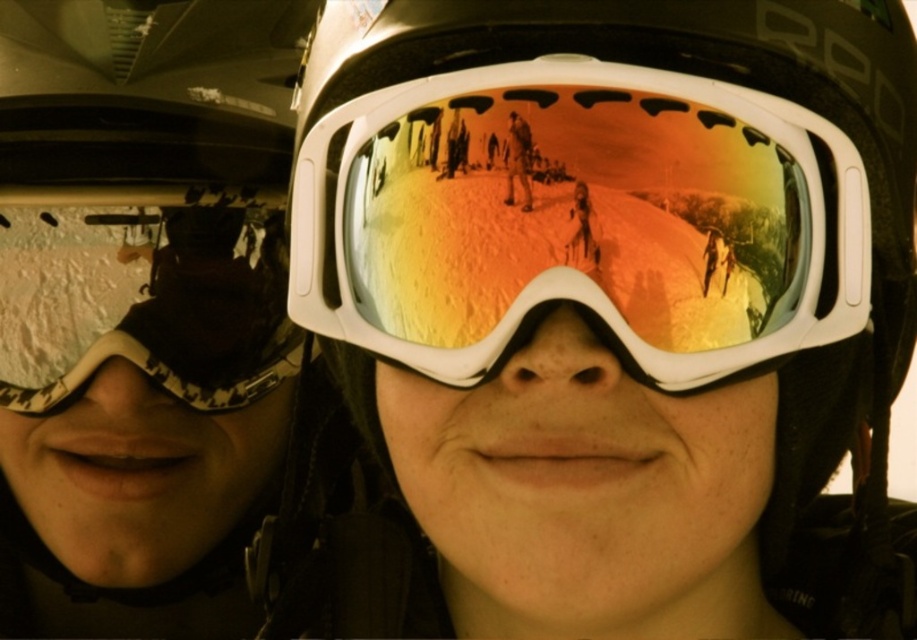
Question: Does white reflective lens at center have a smaller size compared to matte black goggles at left?

Choices:
 (A) no
 (B) yes

Answer: (A)

Question: Can you confirm if white reflective lens at center is positioned below matte black goggles at left?

Choices:
 (A) no
 (B) yes

Answer: (A)

Question: Observing the image, what is the correct spatial positioning of white reflective lens at center in reference to matte black goggles at left?

Choices:
 (A) right
 (B) left

Answer: (A)

Question: Which object appears closest to the camera in this image?

Choices:
 (A) matte black goggles at left
 (B) white reflective lens at center

Answer: (B)

Question: Which of the following is the farthest from the observer?

Choices:
 (A) (575, 173)
 (B) (199, 342)

Answer: (B)